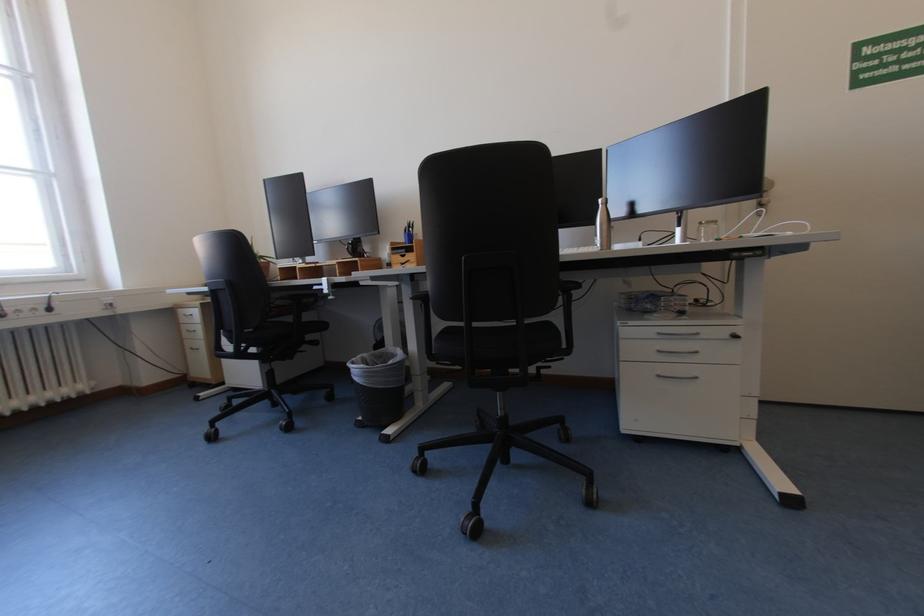
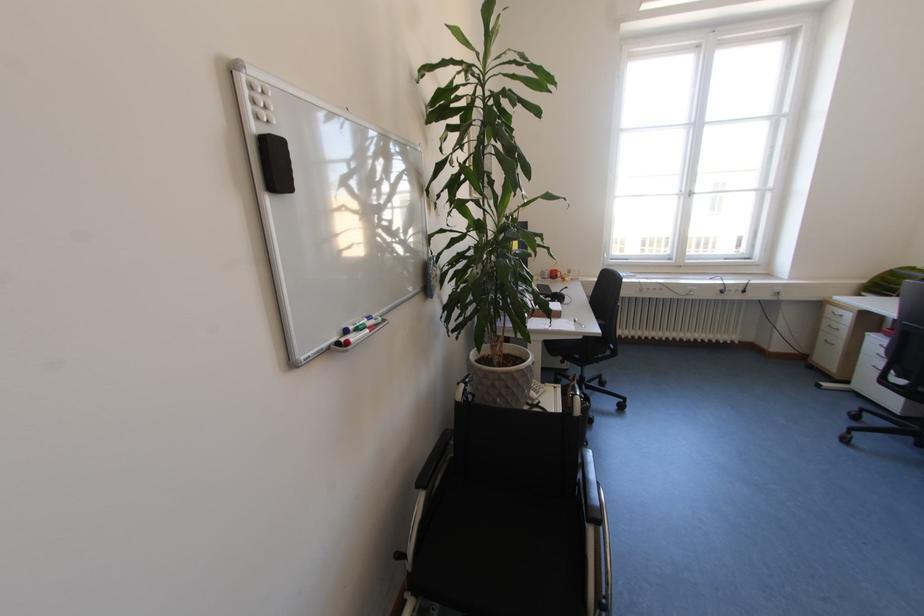
Where in the second image is the point corresponding to the point at 193,336 from the first image?

(833, 328)